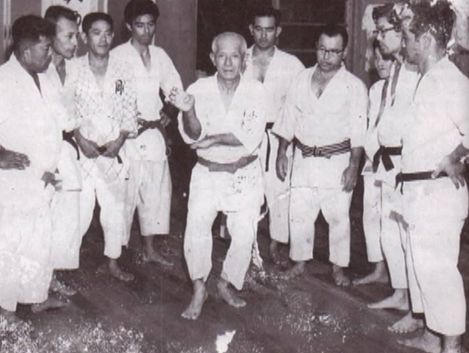
The width and height of the screenshot is (469, 353). In order to click on wall in this screenshot , I will do `click(181, 34)`.